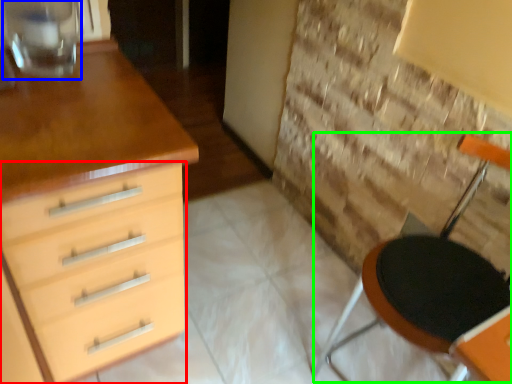
Question: Which object is positioned farthest from chest of drawers (highlighted by a red box)? Select from glass vase (highlighted by a blue box) and armchair (highlighted by a green box).

Choices:
 (A) glass vase
 (B) armchair

Answer: (B)